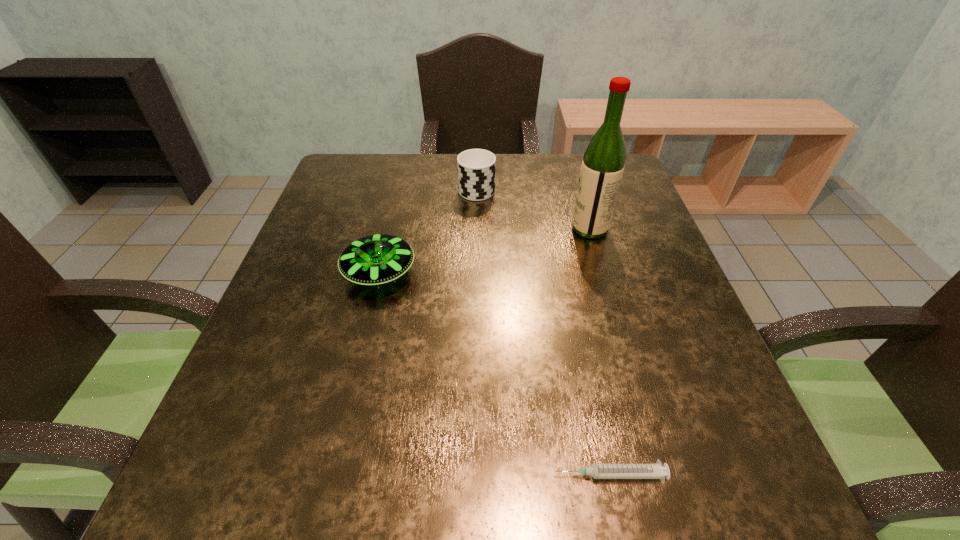
The height and width of the screenshot is (540, 960). I want to click on liquor, so pos(603,164).

What are the coordinates of `the tallest object` in the screenshot? It's located at (603, 164).

Find the location of a particular element. Image resolution: width=960 pixels, height=540 pixels. the third shortest object is located at coordinates (476, 168).

Where is `cup`? The height and width of the screenshot is (540, 960). cup is located at coordinates (476, 168).

The image size is (960, 540). In order to click on the leftmost object in this screenshot , I will do `click(377, 259)`.

Locate an element on the screen. The height and width of the screenshot is (540, 960). the second nearest object is located at coordinates (377, 259).

The width and height of the screenshot is (960, 540). Identify the location of the nearest object. (598, 471).

Identify the location of the shortest object. This screenshot has height=540, width=960. (598, 471).

This screenshot has height=540, width=960. I want to click on free space located on the label of the tallest object, so click(x=421, y=228).

Where is `free space located on the label of the tallest object`? Image resolution: width=960 pixels, height=540 pixels. free space located on the label of the tallest object is located at coordinates (540, 228).